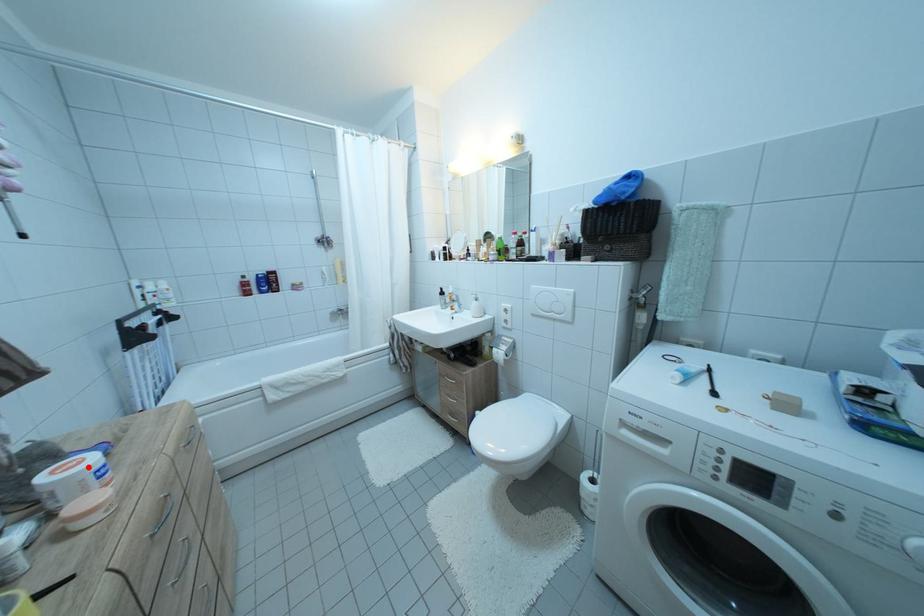
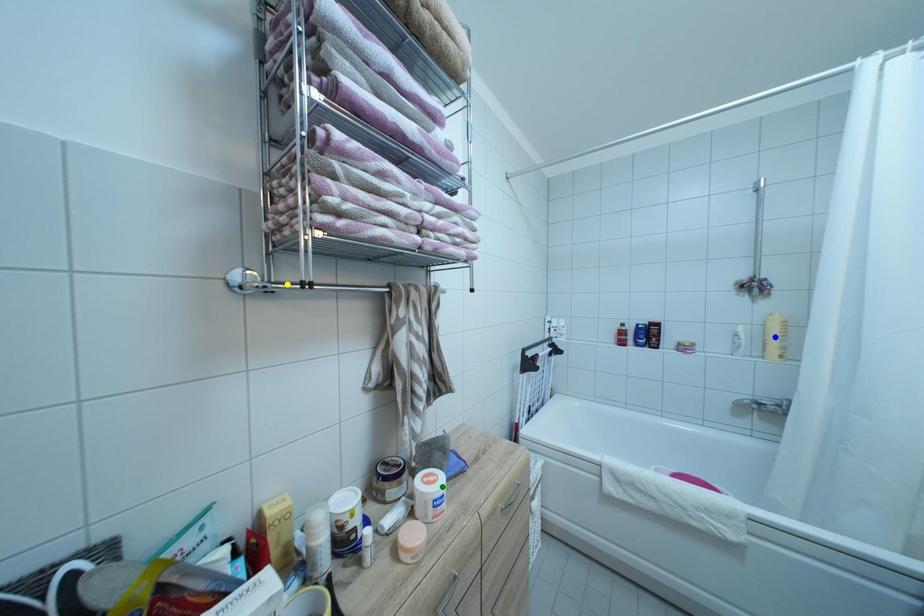
Question: I am providing you with two images of the same scene from different viewpoints. A red point is marked on the first image. You are given multiple points on the second image. Which point in image 2 is actually the same real-world point as the red point in image 1?

Choices:
 (A) blue point
 (B) green point
 (C) yellow point

Answer: (B)